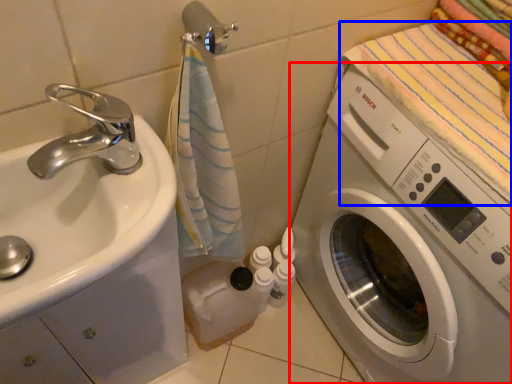
Question: Which object is closer to the camera taking this photo, washing machine (highlighted by a red box) or beach towel (highlighted by a blue box)?

Choices:
 (A) washing machine
 (B) beach towel

Answer: (A)